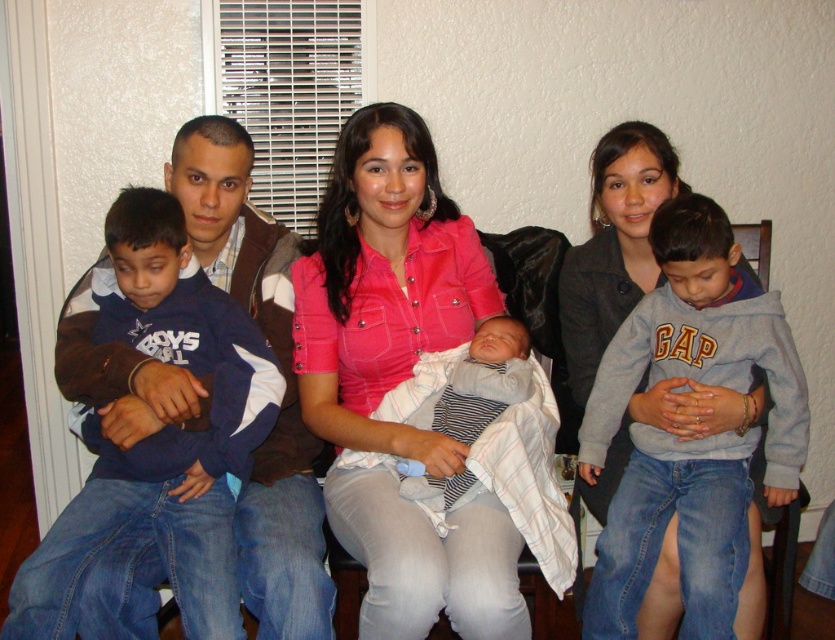
Is brown textured jacket at left above pink fabric shirt at center?

Incorrect, brown textured jacket at left is not positioned above pink fabric shirt at center.

Between brown textured jacket at left and pink fabric shirt at center, which one appears on the right side from the viewer's perspective?

From the viewer's perspective, pink fabric shirt at center appears more on the right side.

Where is `brown textured jacket at left`? brown textured jacket at left is located at coordinates coord(281,369).

At what (x,y) coordinates should I click in order to perform the action: click on brown textured jacket at left. Please return your answer as a coordinate pair (x, y). The width and height of the screenshot is (835, 640). Looking at the image, I should click on (281, 369).

Is point (434, 268) less distant than point (464, 364)?

No, it is not.

Does pink denim shirt at center have a lesser width compared to striped knit sweater at center?

In fact, pink denim shirt at center might be wider than striped knit sweater at center.

Identify the location of pink denim shirt at center. (383, 285).

You are a GUI agent. You are given a task and a screenshot of the screen. Output one action in this format:
    pyautogui.click(x=<x>, y=<y>)
    Task: Click on the pink denim shirt at center
    
    Given the screenshot: What is the action you would take?
    pyautogui.click(x=383, y=285)

Can you confirm if pink denim shirt at center is positioned to the left of pink fabric shirt at center?

Yes, pink denim shirt at center is to the left of pink fabric shirt at center.

Who is more distant from viewer, (334, 320) or (578, 268)?

The point (578, 268) is behind.

Where is `pink denim shirt at center`? pink denim shirt at center is located at coordinates (383, 285).